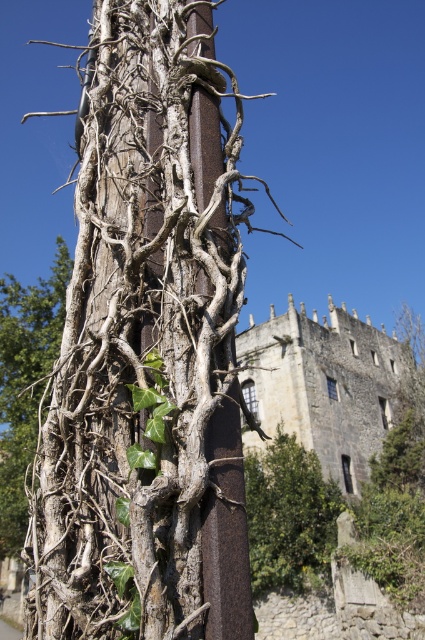
Is rusty wood tree trunk at left below dry wood vine at left?

Actually, rusty wood tree trunk at left is above dry wood vine at left.

Which is more to the right, rusty wood tree trunk at left or dry wood vine at left?

From the viewer's perspective, rusty wood tree trunk at left appears more on the right side.

Does point (147, 324) come farther from viewer compared to point (25, 352)?

No, it is in front of (25, 352).

Where is `rusty wood tree trunk at left`? This screenshot has width=425, height=640. rusty wood tree trunk at left is located at coordinates (147, 349).

In the scene shown: Is green leafy tree at center further to the viewer compared to dry wood vine at left?

Yes, it is behind dry wood vine at left.

Looking at this image, between green leafy tree at center and dry wood vine at left, which one has more height?

dry wood vine at left is taller.

Between point (280, 525) and point (5, 300), which one is positioned behind?

Positioned behind is point (280, 525).

Where is `green leafy tree at center`? green leafy tree at center is located at coordinates (289, 516).

Does rusty wood tree trunk at left lie in front of green leafy tree at center?

Yes, it is in front of green leafy tree at center.

How distant is rusty wood tree trunk at left from green leafy tree at center?

rusty wood tree trunk at left is 157.14 feet away from green leafy tree at center.

Find the location of a particular element. This screenshot has width=425, height=640. rusty wood tree trunk at left is located at coordinates [147, 349].

Identify the location of rusty wood tree trunk at left. The height and width of the screenshot is (640, 425). (147, 349).